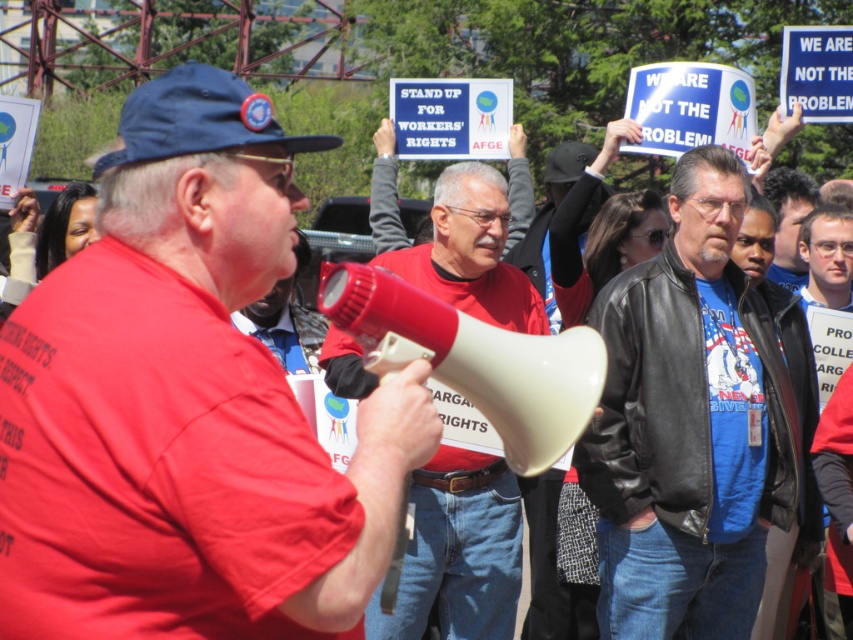
You are a photographer trying to capture both the matte red shirt at center and the red fabric shirt at center in a single frame. Based on their positions, which shirt should you focus on first to ensure both are in the shot?

The matte red shirt at center is wider than the red fabric shirt at center, so focusing on the matte red shirt at center first will ensure both are in the shot.